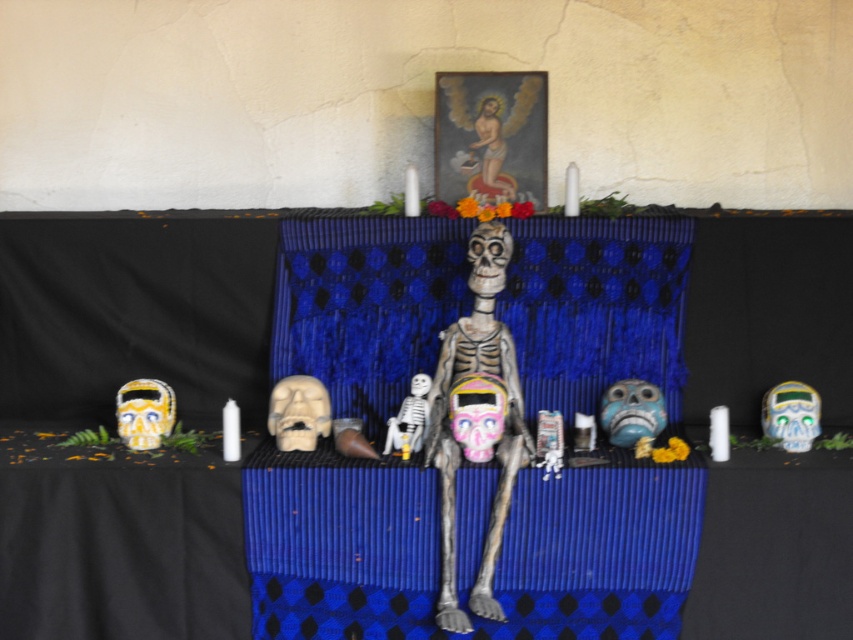
Can you confirm if painted ceramic skull at center is shorter than white matte skeleton at center?

Incorrect, painted ceramic skull at center's height does not fall short of white matte skeleton at center's.

From the picture: Between painted ceramic skull at center and white matte skeleton at center, which one has less height?

With less height is white matte skeleton at center.

Is point (468, 429) more distant than point (402, 406)?

No, (468, 429) is in front of (402, 406).

What are the coordinates of `painted ceramic skull at center` in the screenshot? It's located at (477, 413).

Between point (303, 381) and point (480, 269), which one is positioned in front?

Point (480, 269)

Can you confirm if matte white skull at center is thinner than white matte skull at center?

In fact, matte white skull at center might be wider than white matte skull at center.

You are a GUI agent. You are given a task and a screenshot of the screen. Output one action in this format:
    pyautogui.click(x=<x>, y=<y>)
    Task: Click on the matte white skull at center
    
    Given the screenshot: What is the action you would take?
    pyautogui.click(x=299, y=412)

This screenshot has width=853, height=640. Identify the location of matte white skull at center. (299, 412).

Between smooth painted skeleton at center and blue painted wood skull at center, which one has more height?

smooth painted skeleton at center

Does point (454, 528) come closer to viewer compared to point (628, 392)?

Yes, point (454, 528) is closer to viewer.

Locate an element on the screen. Image resolution: width=853 pixels, height=640 pixels. smooth painted skeleton at center is located at coordinates (457, 426).